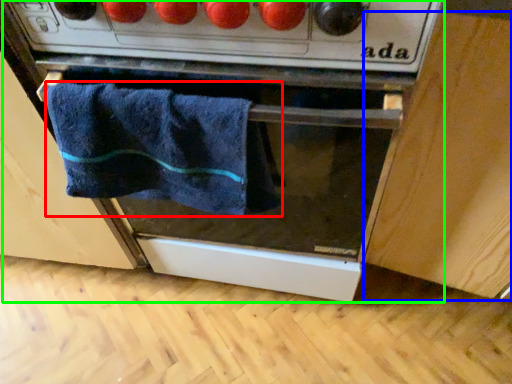
Question: Considering the real-world distances, which object is farthest from towel (highlighted by a red box)? cabinetry (highlighted by a blue box) or oven (highlighted by a green box)?

Choices:
 (A) cabinetry
 (B) oven

Answer: (A)